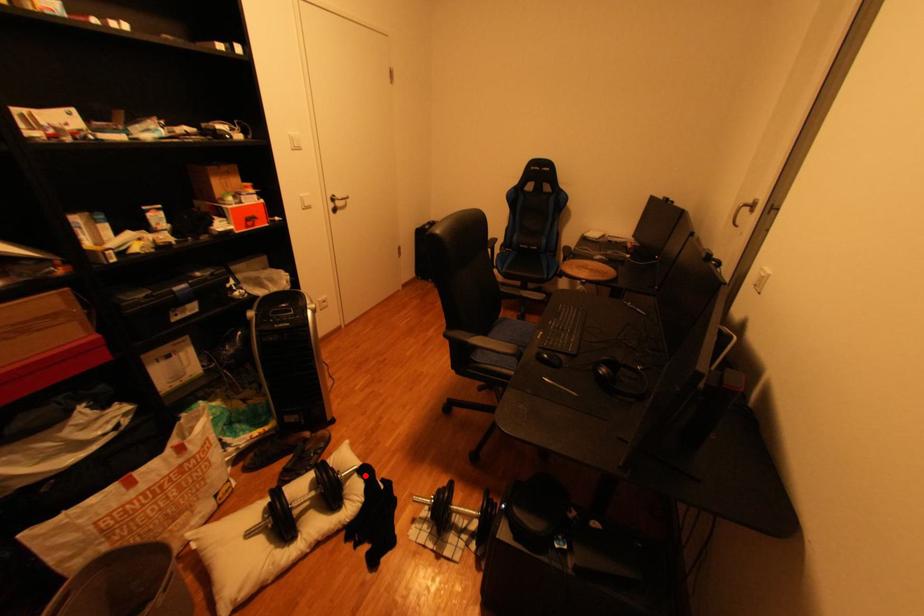
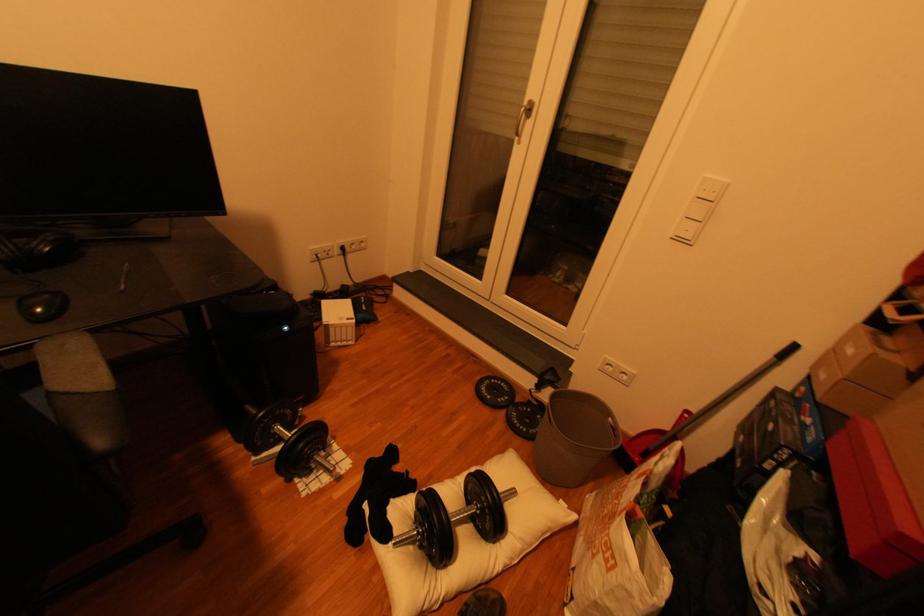
Where in the second image is the point corresponding to the highlighted location from the first image?

(406, 533)